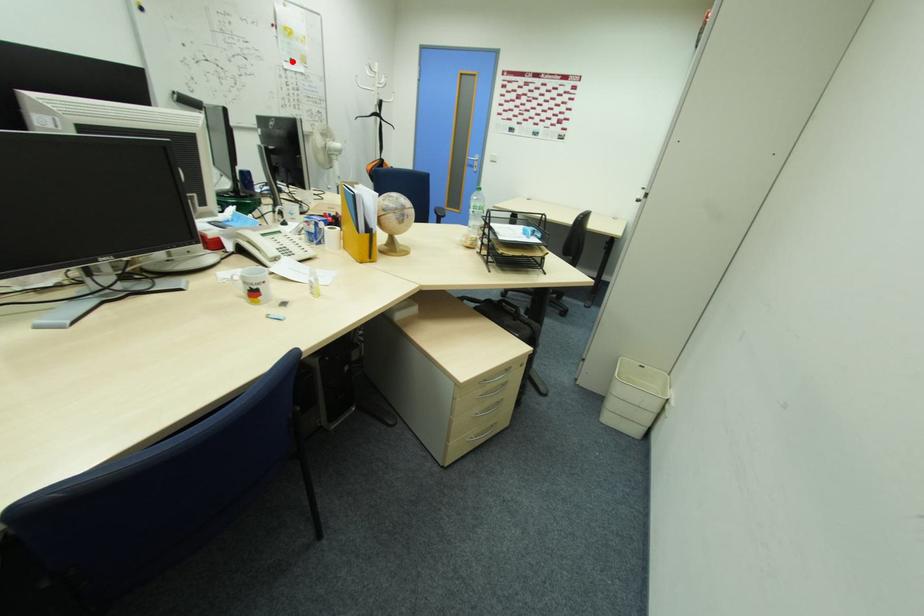
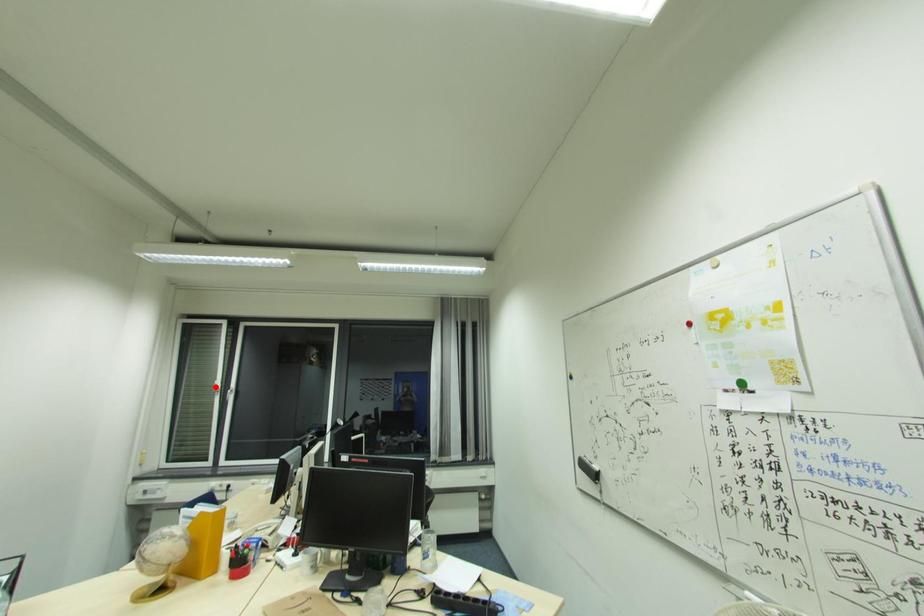
I am providing you with two images of the same scene from different viewpoints. A red point is marked on the first image and another point is marked on the second image. Are the points marked in image1 and image2 representing the same 3D position?

No